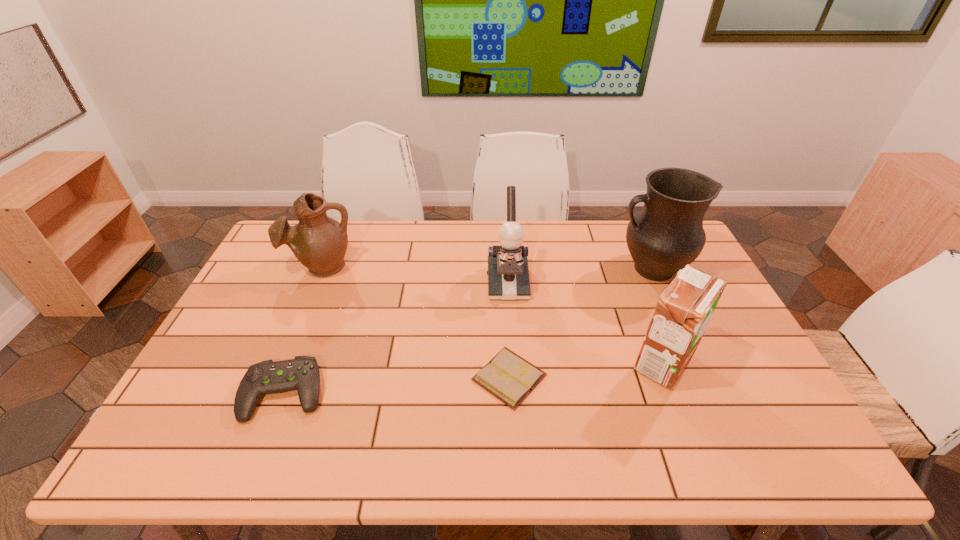
I want to click on free space that is in between the shortest object and the microscope, so (x=509, y=330).

Image resolution: width=960 pixels, height=540 pixels. I want to click on vacant space that's between the right pitcher and the fifth tallest object, so click(x=468, y=331).

You are a GUI agent. You are given a task and a screenshot of the screen. Output one action in this format:
    pyautogui.click(x=<x>, y=<y>)
    Task: Click on the free space that is in between the diary and the carton
    The image size is (960, 540).
    Given the screenshot: What is the action you would take?
    pyautogui.click(x=587, y=370)

This screenshot has width=960, height=540. What are the coordinates of `free spot between the microscope and the fifth tallest object` in the screenshot? It's located at (396, 338).

At what (x,y) coordinates should I click in order to perform the action: click on free space between the carton and the shorter pitcher. Please return your answer as a coordinate pair (x, y). The width and height of the screenshot is (960, 540). Looking at the image, I should click on (492, 314).

Locate an element on the screen. free space between the left pitcher and the diary is located at coordinates (416, 322).

Identify the location of object that is the second closest one to the diary. Image resolution: width=960 pixels, height=540 pixels. (684, 309).

Point out which object is positioned as the fourth nearest to the shortest object. Please provide its 2D coordinates. Your answer should be formatted as a tuple, i.e. [(x, y)], where the tuple contains the x and y coordinates of a point satisfying the conditions above.

[(302, 373)]

This screenshot has width=960, height=540. In order to click on free space that satisfies the following two spatial constraints: 1. on the back side of the second shortest object; 2. on the left side of the shortest object in this screenshot , I will do `click(291, 377)`.

Where is `vacant space that satisfies the following two spatial constraints: 1. at the spout of the diary; 2. on the right side of the shorter pitcher`? vacant space that satisfies the following two spatial constraints: 1. at the spout of the diary; 2. on the right side of the shorter pitcher is located at coordinates (275, 377).